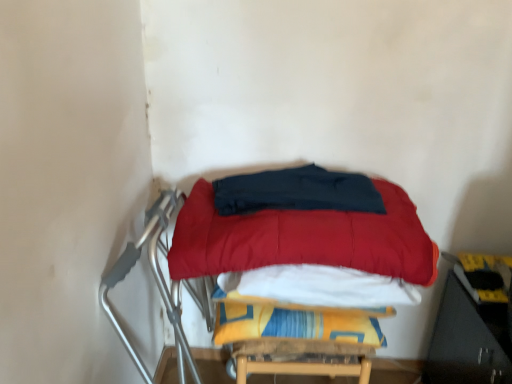
This screenshot has height=384, width=512. What do you see at coordinates (297, 191) in the screenshot? I see `dark blue fabric at center, the first blanket when ordered from top to bottom` at bounding box center [297, 191].

Describe the element at coordinates (293, 321) in the screenshot. This screenshot has height=384, width=512. I see `yellow fabric blanket at center, marked as the first blanket in a bottom-to-top arrangement` at that location.

The image size is (512, 384). Identify the location of dark blue fabric at center, placed as the 2th blanket when sorted from bottom to top. (297, 191).

Considering the sizes of objects velvet red mattress at center and yellow fabric blanket at center, marked as the first blanket in a bottom-to-top arrangement, in the image provided, who is wider, velvet red mattress at center or yellow fabric blanket at center, marked as the first blanket in a bottom-to-top arrangement,?

With larger width is velvet red mattress at center.

From a real-world perspective, is velvet red mattress at center positioned under yellow fabric blanket at center, marked as the first blanket in a bottom-to-top arrangement, based on gravity?

Actually, velvet red mattress at center is physically above yellow fabric blanket at center, marked as the first blanket in a bottom-to-top arrangement, in the real world.

Based on the photo, how different are the orientations of velvet red mattress at center and yellow fabric blanket at center, the 2th blanket when ordered from top to bottom, in degrees?

0.000425 degrees separate the facing orientations of velvet red mattress at center and yellow fabric blanket at center, the 2th blanket when ordered from top to bottom.

Is point (237, 227) closer to camera compared to point (226, 296)?

Yes, point (237, 227) is closer to viewer.

From the image's perspective, is dark blue fabric at center, the first blanket when ordered from top to bottom, on yellow fabric blanket at center, the 2th blanket when ordered from top to bottom?

Yes.

Does point (340, 188) come farther from viewer compared to point (275, 325)?

Yes, point (340, 188) is farther from viewer.

Is dark blue fabric at center, the first blanket when ordered from top to bottom, positioned beyond the bounds of yellow fabric blanket at center, marked as the first blanket in a bottom-to-top arrangement?

Yes, dark blue fabric at center, the first blanket when ordered from top to bottom, is not within yellow fabric blanket at center, marked as the first blanket in a bottom-to-top arrangement.

Considering the sizes of dark blue fabric at center, the first blanket when ordered from top to bottom, and yellow fabric blanket at center, the 2th blanket when ordered from top to bottom, in the image, is dark blue fabric at center, the first blanket when ordered from top to bottom, taller or shorter than yellow fabric blanket at center, the 2th blanket when ordered from top to bottom,?

dark blue fabric at center, the first blanket when ordered from top to bottom, is shorter than yellow fabric blanket at center, the 2th blanket when ordered from top to bottom.

From the picture: Considering the sizes of objects yellow fabric blanket at center, the 2th blanket when ordered from top to bottom, and dark blue fabric at center, placed as the 2th blanket when sorted from bottom to top, in the image provided, who is shorter, yellow fabric blanket at center, the 2th blanket when ordered from top to bottom, or dark blue fabric at center, placed as the 2th blanket when sorted from bottom to top,?

With less height is dark blue fabric at center, placed as the 2th blanket when sorted from bottom to top.

Considering the positions of point (239, 312) and point (259, 188), is point (239, 312) closer or farther from the camera than point (259, 188)?

Point (239, 312).

In terms of width, does yellow fabric blanket at center, the 2th blanket when ordered from top to bottom, look wider or thinner when compared to dark blue fabric at center, the first blanket when ordered from top to bottom?

Considering their sizes, yellow fabric blanket at center, the 2th blanket when ordered from top to bottom, looks broader than dark blue fabric at center, the first blanket when ordered from top to bottom.

In the scene shown: From the image's perspective, relative to dark blue fabric at center, placed as the 2th blanket when sorted from bottom to top, is yellow fabric blanket at center, marked as the first blanket in a bottom-to-top arrangement, above or below?

yellow fabric blanket at center, marked as the first blanket in a bottom-to-top arrangement, is below dark blue fabric at center, placed as the 2th blanket when sorted from bottom to top.

Which is closer, (x=298, y=258) or (x=300, y=173)?

Point (x=298, y=258)

In the scene shown: Is velvet red mattress at center touching dark blue fabric at center, placed as the 2th blanket when sorted from bottom to top?

Yes, velvet red mattress at center is right next to dark blue fabric at center, placed as the 2th blanket when sorted from bottom to top, and making contact.

Does velvet red mattress at center have a smaller size compared to dark blue fabric at center, placed as the 2th blanket when sorted from bottom to top?

No, velvet red mattress at center is not smaller than dark blue fabric at center, placed as the 2th blanket when sorted from bottom to top.

From the image's perspective, does velvet red mattress at center appear higher than dark blue fabric at center, placed as the 2th blanket when sorted from bottom to top?

No, from the image's perspective, velvet red mattress at center is not over dark blue fabric at center, placed as the 2th blanket when sorted from bottom to top.

Is dark blue fabric at center, placed as the 2th blanket when sorted from bottom to top, directly adjacent to velvet red mattress at center?

Yes, dark blue fabric at center, placed as the 2th blanket when sorted from bottom to top, is beside velvet red mattress at center.

Does point (294, 197) appear closer or farther from the camera than point (219, 232)?

Point (294, 197) is positioned farther from the camera compared to point (219, 232).

Which is more to the left, dark blue fabric at center, placed as the 2th blanket when sorted from bottom to top, or velvet red mattress at center?

Positioned to the left is dark blue fabric at center, placed as the 2th blanket when sorted from bottom to top.

Is dark blue fabric at center, placed as the 2th blanket when sorted from bottom to top, outside of velvet red mattress at center?

No, dark blue fabric at center, placed as the 2th blanket when sorted from bottom to top, is not entirely external to velvet red mattress at center.

Relative to velvet red mattress at center, is yellow fabric blanket at center, marked as the first blanket in a bottom-to-top arrangement, in front or behind?

In the image, yellow fabric blanket at center, marked as the first blanket in a bottom-to-top arrangement, appears behind velvet red mattress at center.

Is yellow fabric blanket at center, the 2th blanket when ordered from top to bottom, wider than velvet red mattress at center?

In fact, yellow fabric blanket at center, the 2th blanket when ordered from top to bottom, might be narrower than velvet red mattress at center.

From the image's perspective, which one is positioned higher, yellow fabric blanket at center, the 2th blanket when ordered from top to bottom, or velvet red mattress at center?

velvet red mattress at center is shown above in the image.

Considering the points (219, 301) and (373, 184), which point is in front, point (219, 301) or point (373, 184)?

The point (219, 301) is closer to the camera.

In the image, there is a velvet red mattress at center. Where is `blanket below it (from the image's perspective)`? The image size is (512, 384). blanket below it (from the image's perspective) is located at coordinates (293, 321).

What are the coordinates of `blanket that is in front of the yellow fabric blanket at center, the 2th blanket when ordered from top to bottom` in the screenshot? It's located at (297, 191).

Which object lies nearer to the anchor point velvet red mattress at center, yellow fabric blanket at center, the 2th blanket when ordered from top to bottom, or dark blue fabric at center, placed as the 2th blanket when sorted from bottom to top?

dark blue fabric at center, placed as the 2th blanket when sorted from bottom to top, lies closer to velvet red mattress at center than the other object.

Which object lies nearer to the anchor point dark blue fabric at center, the first blanket when ordered from top to bottom, yellow fabric blanket at center, marked as the first blanket in a bottom-to-top arrangement, or velvet red mattress at center?

velvet red mattress at center.

From the image, which object appears to be farther from velvet red mattress at center, dark blue fabric at center, placed as the 2th blanket when sorted from bottom to top, or yellow fabric blanket at center, the 2th blanket when ordered from top to bottom?

yellow fabric blanket at center, the 2th blanket when ordered from top to bottom.

Considering their positions, is velvet red mattress at center positioned closer to dark blue fabric at center, placed as the 2th blanket when sorted from bottom to top, than yellow fabric blanket at center, the 2th blanket when ordered from top to bottom?

Based on the image, velvet red mattress at center appears to be nearer to dark blue fabric at center, placed as the 2th blanket when sorted from bottom to top.

Looking at the image, which one is located further to yellow fabric blanket at center, marked as the first blanket in a bottom-to-top arrangement, dark blue fabric at center, placed as the 2th blanket when sorted from bottom to top, or velvet red mattress at center?

dark blue fabric at center, placed as the 2th blanket when sorted from bottom to top, lies further to yellow fabric blanket at center, marked as the first blanket in a bottom-to-top arrangement, than the other object.

Estimate the real-world distances between objects in this image. Which object is closer to yellow fabric blanket at center, marked as the first blanket in a bottom-to-top arrangement, velvet red mattress at center or dark blue fabric at center, the first blanket when ordered from top to bottom?

velvet red mattress at center is positioned closer to the anchor yellow fabric blanket at center, marked as the first blanket in a bottom-to-top arrangement.

Where is `mattress between dark blue fabric at center, placed as the 2th blanket when sorted from bottom to top, and yellow fabric blanket at center, the 2th blanket when ordered from top to bottom, from top to bottom`? The image size is (512, 384). mattress between dark blue fabric at center, placed as the 2th blanket when sorted from bottom to top, and yellow fabric blanket at center, the 2th blanket when ordered from top to bottom, from top to bottom is located at coordinates (303, 238).